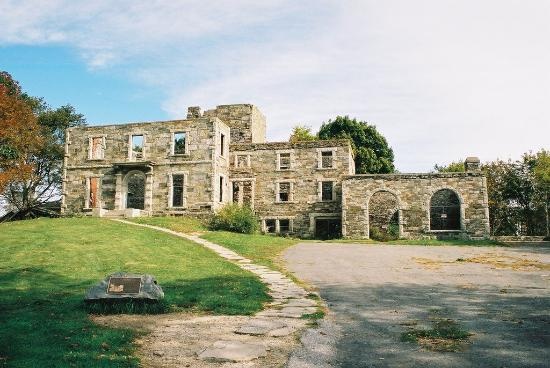
Find the location of a particular element. chimney is located at coordinates (187, 110).